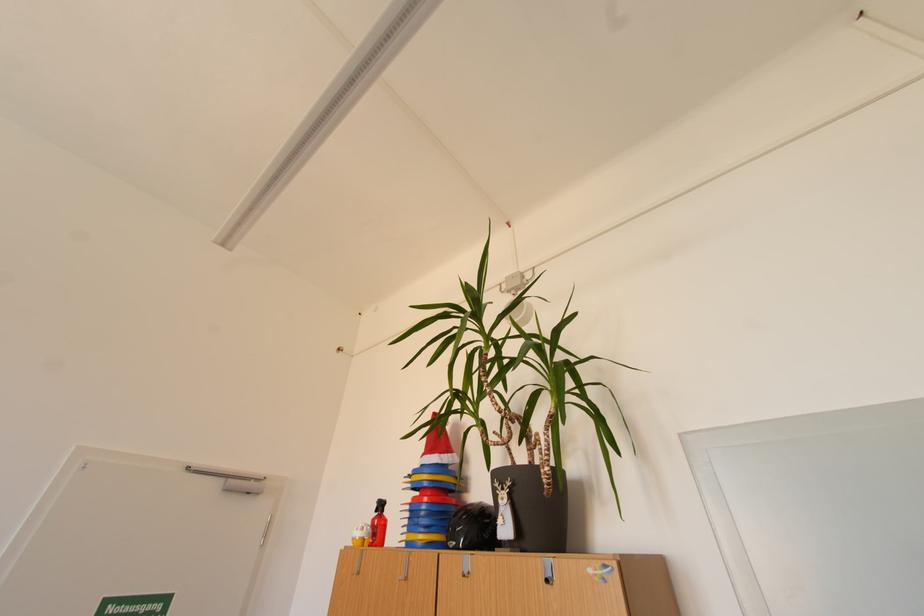
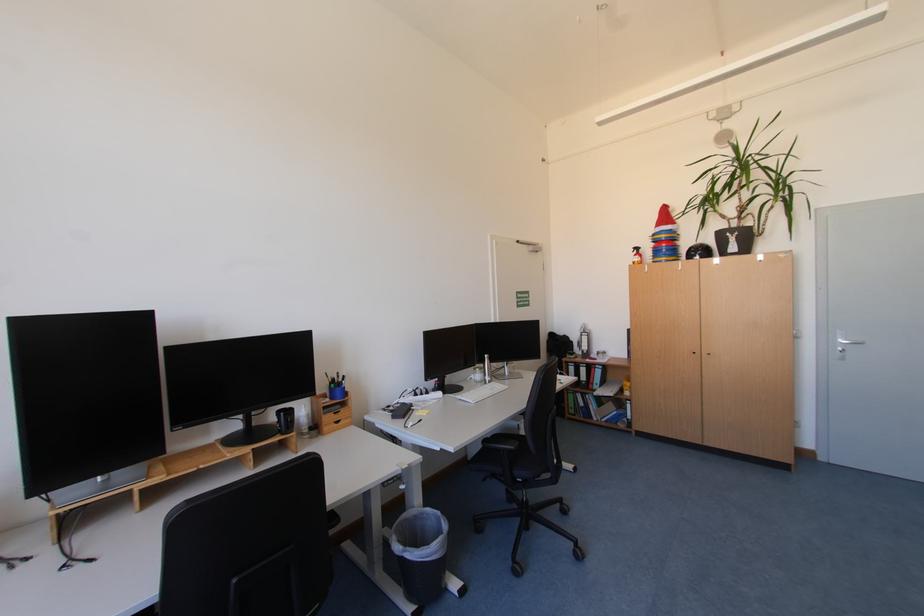
In the second image, find the point that corresponds to [431,514] in the first image.

(672, 252)